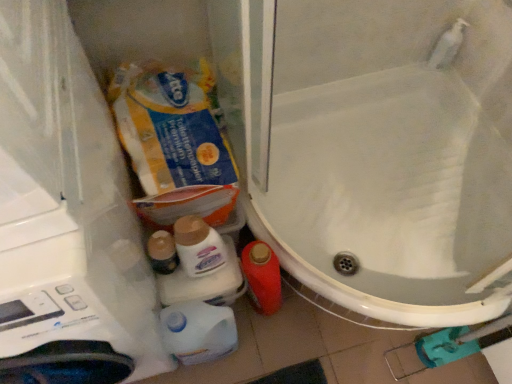
Question: Is point (132, 124) closer or farther from the camera than point (201, 231)?

Choices:
 (A) farther
 (B) closer

Answer: (A)

Question: In terms of width, does yellow cardboard toilet paper at upper left look wider or thinner when compared to matte plastic bottle at lower center, the second cleaning product positioned from the bottom?

Choices:
 (A) thin
 (B) wide

Answer: (B)

Question: Considering the real-world distances, which object is farthest from the matte plastic toiletries at center?

Choices:
 (A) yellow cardboard toilet paper at upper left
 (B) matte plastic bottle at lower center, the second cleaning product positioned from the bottom
 (C) white glossy toilet at lower left
 (D) white glossy bottle at lower center, which ranks as the second cleaning product in top-to-bottom order

Answer: (C)

Question: Based on their relative distances, which object is nearer to the matte plastic toiletries at center?

Choices:
 (A) white glossy toilet at lower left
 (B) matte plastic bottle at lower center, which is the 1th cleaning product in top-to-bottom order
 (C) white glossy bottle at lower center, which ranks as the second cleaning product in top-to-bottom order
 (D) yellow cardboard toilet paper at upper left

Answer: (B)